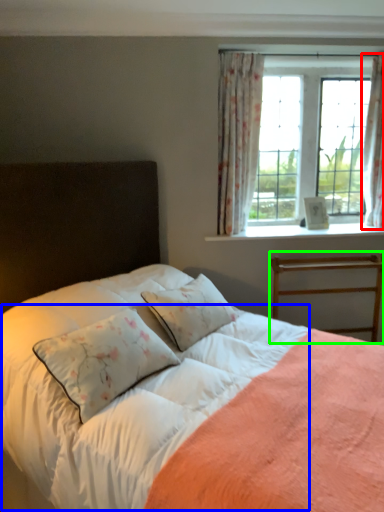
Question: Considering the real-world distances, which object is closest to curtain (highlighted by a red box)? sheet (highlighted by a blue box) or bed frame (highlighted by a green box).

Choices:
 (A) sheet
 (B) bed frame

Answer: (B)